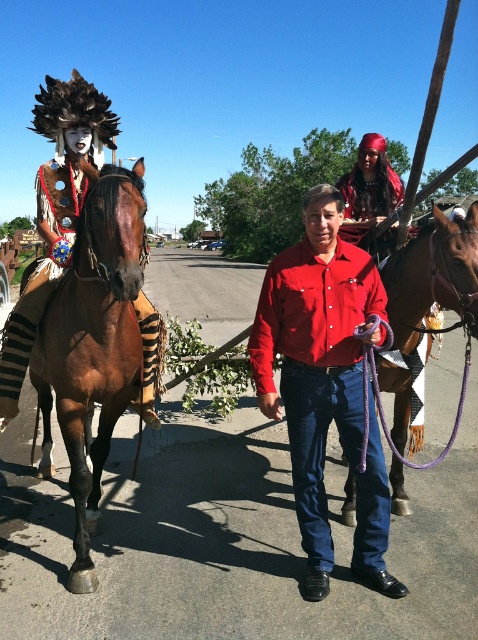
Question: Where is brown glossy horse at left located in relation to shiny red fabric at upper right in the image?

Choices:
 (A) left
 (B) right

Answer: (A)

Question: Observing the image, what is the correct spatial positioning of red cotton shirt at center in reference to brown glossy horse at left?

Choices:
 (A) above
 (B) below

Answer: (A)

Question: Which of the following is the farthest from the observer?

Choices:
 (A) brown leather horse at center
 (B) shiny red fabric at upper right
 (C) red cotton shirt at center
 (D) brown glossy horse at left

Answer: (B)

Question: Does brown glossy horse at left have a smaller size compared to shiny red fabric at upper right?

Choices:
 (A) no
 (B) yes

Answer: (B)

Question: Which point is closer to the camera?

Choices:
 (A) red cotton shirt at center
 (B) brown glossy horse at left
 (C) brown leather horse at center

Answer: (B)

Question: Among these objects, which one is farthest from the camera?

Choices:
 (A) brown leather horse at center
 (B) brown glossy horse at left

Answer: (A)